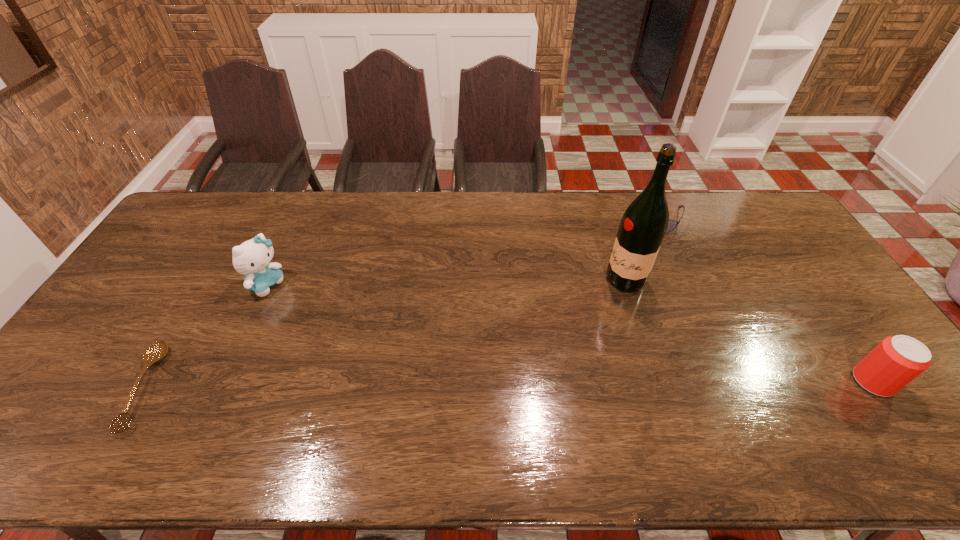
Find the location of `vacant space located 0.170m on the lenses of the farthest object`. vacant space located 0.170m on the lenses of the farthest object is located at coordinates (632, 260).

Where is `object situated at the far edge`? The image size is (960, 540). object situated at the far edge is located at coordinates (672, 224).

The height and width of the screenshot is (540, 960). Find the location of `ladle situated at the near edge`. ladle situated at the near edge is located at coordinates (158, 350).

The width and height of the screenshot is (960, 540). I want to click on beer can situated at the near edge, so click(x=896, y=361).

At what (x,y) coordinates should I click in order to perform the action: click on object that is at the right edge. Please return your answer as a coordinate pair (x, y). This screenshot has height=540, width=960. Looking at the image, I should click on (896, 361).

Find the location of a particular element. The height and width of the screenshot is (540, 960). object located at the near right corner is located at coordinates (896, 361).

In the image, there is a desktop. At what (x,y) coordinates should I click in order to perform the action: click on vacant space at the far edge. Please return your answer as a coordinate pair (x, y). Image resolution: width=960 pixels, height=540 pixels. Looking at the image, I should click on (683, 217).

Where is `vacant position at the near edge of the desktop`? This screenshot has width=960, height=540. vacant position at the near edge of the desktop is located at coordinates (540, 401).

Where is `free region at the left edge of the desktop`? free region at the left edge of the desktop is located at coordinates (83, 354).

Locate an element on the screen. Image resolution: width=960 pixels, height=540 pixels. vacant region at the near left corner of the desktop is located at coordinates (108, 389).